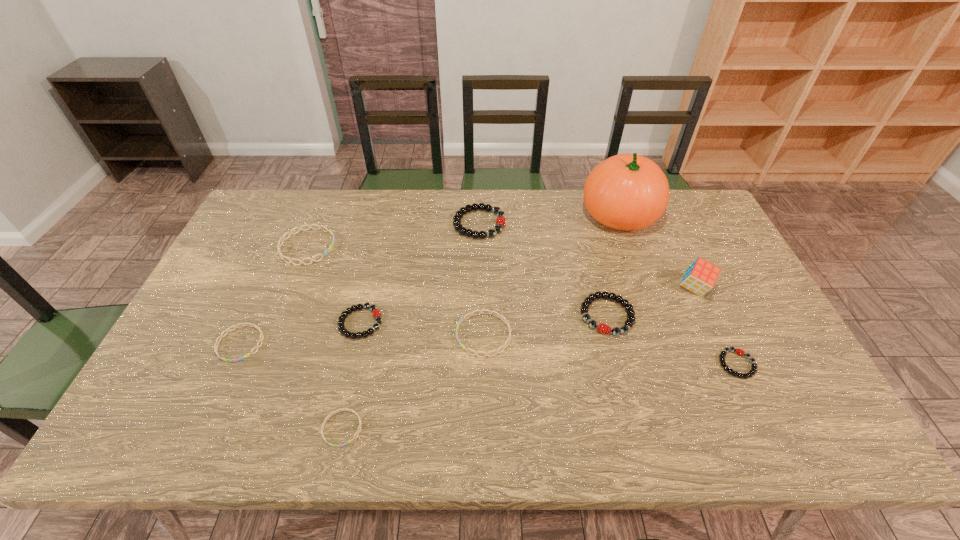
Identify the location of the third biggest blue bracelet. The image size is (960, 540). 221,336.

Locate an element on the screen. the rightmost black bracelet is located at coordinates (738, 351).

At what (x,y) coordinates should I click in order to perform the action: click on the rightmost bracelet. Please return your answer as a coordinate pair (x, y). Image resolution: width=960 pixels, height=540 pixels. Looking at the image, I should click on (738, 351).

Find the location of a particular element. Image resolution: width=960 pixels, height=540 pixels. the nearest blue bracelet is located at coordinates (360, 423).

You are a GUI agent. You are given a task and a screenshot of the screen. Output one action in this format:
    pyautogui.click(x=<x>, y=<y>)
    Task: Click on the nearest bracelet
    
    Given the screenshot: What is the action you would take?
    pyautogui.click(x=360, y=423)

In order to click on vacant space located 0.280m on the left of the pumpkin in this screenshot , I will do `click(499, 215)`.

Locate an element on the screen. The height and width of the screenshot is (540, 960). vacant space located 0.070m on the front of the cube is located at coordinates (709, 322).

Where is `vacant area situated 0.110m on the left of the eighth shortest object`? The width and height of the screenshot is (960, 540). vacant area situated 0.110m on the left of the eighth shortest object is located at coordinates (420, 224).

Identify the location of vacant area situated 0.160m on the surface of the farthest blue bracelet showing star-shaped elements. Image resolution: width=960 pixels, height=540 pixels. (385, 247).

In order to click on free region located on the left of the seventh bracelet from left to right in this screenshot , I will do `click(512, 316)`.